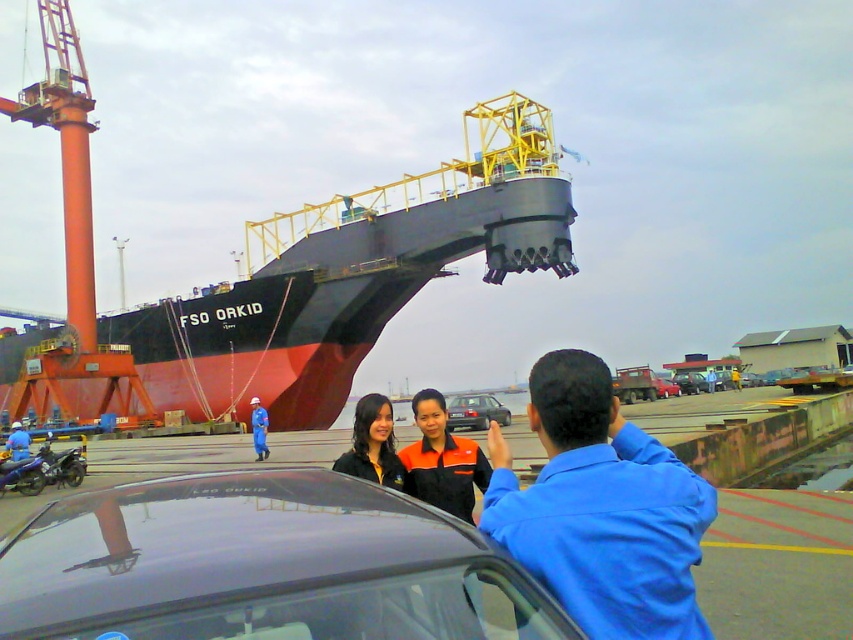
In the scene shown: You are a photographer trying to capture a group photo of the two women and the man in the blue shirt near the satin silver sedan at center and the blue fabric uniform at center. Since the sedan is smaller than the uniform, how should you position the subjects to ensure both the sedan and the uniform are clearly visible in the frame?

Since the satin silver sedan at center is smaller than the blue fabric uniform at center, position the subjects so the sedan is closer to the camera and the uniform is farther back. This way, the sedan will appear larger in the frame, balancing its size with the uniform for better visibility.

You are a photographer trying to capture a photo of the black matte ship at center and the matte black jacket at center. Since you want both subjects to be in focus, which one should you focus on first to ensure depth of field covers both?

The black matte ship at center is further to the viewer than the matte black jacket at center, so you should focus on the black matte ship at center first to ensure depth of field covers both.

You are a photographer standing at the edge of the port. You want to take a photo of the glossy black car at center and the blue fabric uniform at center. Based on their positions, which object should you focus on first to ensure both are in frame?

The glossy black car at center is located above the blue fabric uniform at center. To ensure both are in frame, focus on the glossy black car at center first as it is higher up, allowing the blue fabric uniform at center to naturally come into view below it.